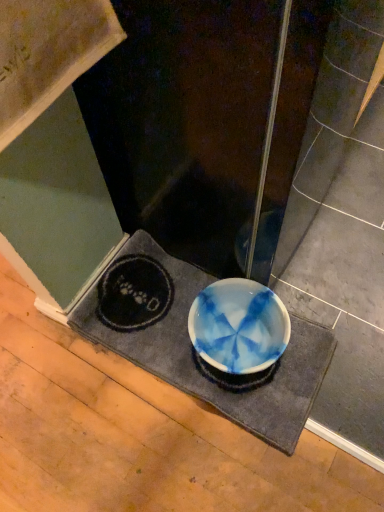
Find the location of `blue tie-dye fabric bath mat at center`. blue tie-dye fabric bath mat at center is located at coordinates (191, 345).

What do you see at coordinates (191, 345) in the screenshot? I see `blue tie-dye fabric bath mat at center` at bounding box center [191, 345].

In order to click on blue tie-dye fabric bath mat at center in this screenshot , I will do `click(191, 345)`.